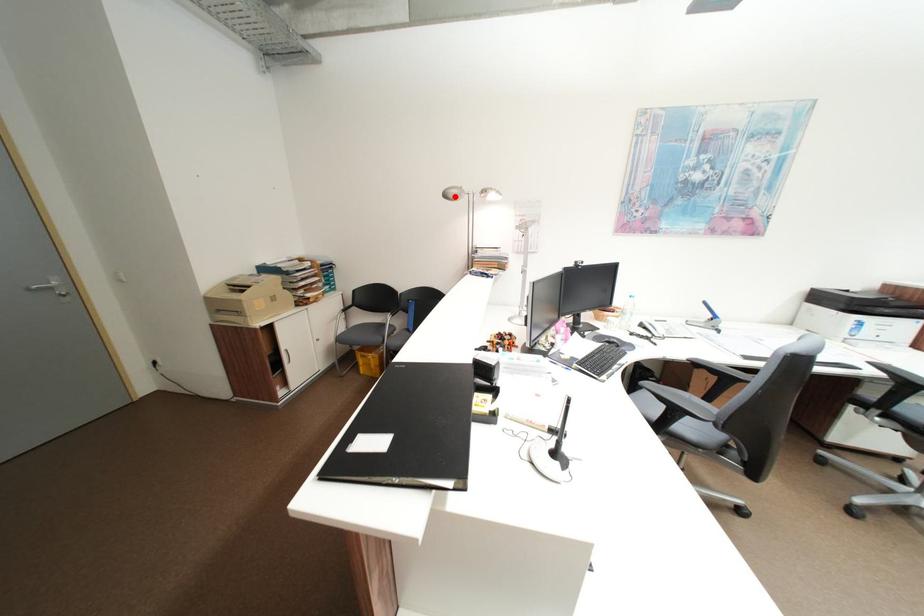
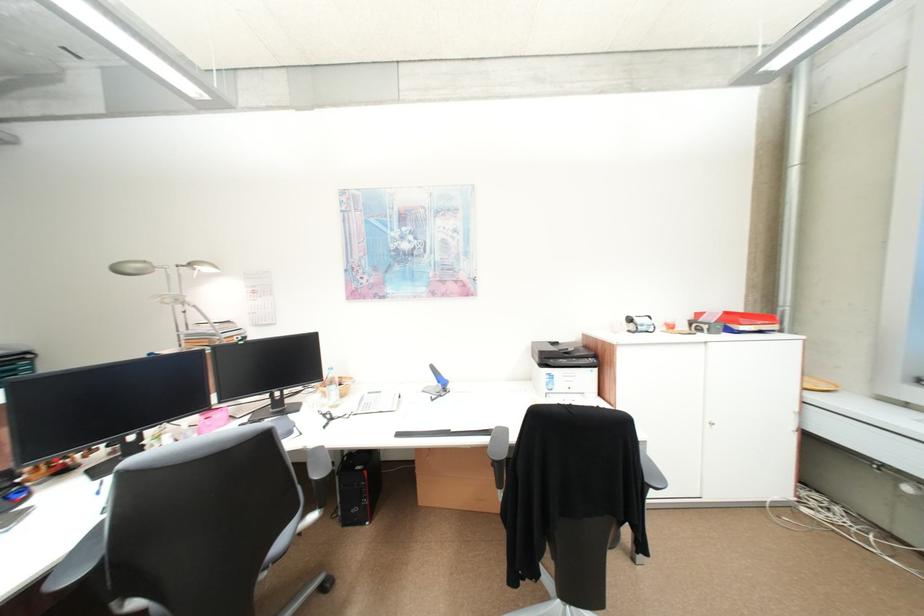
Where in the second image is the point corresponding to the highlighted location from the first image?

(127, 272)